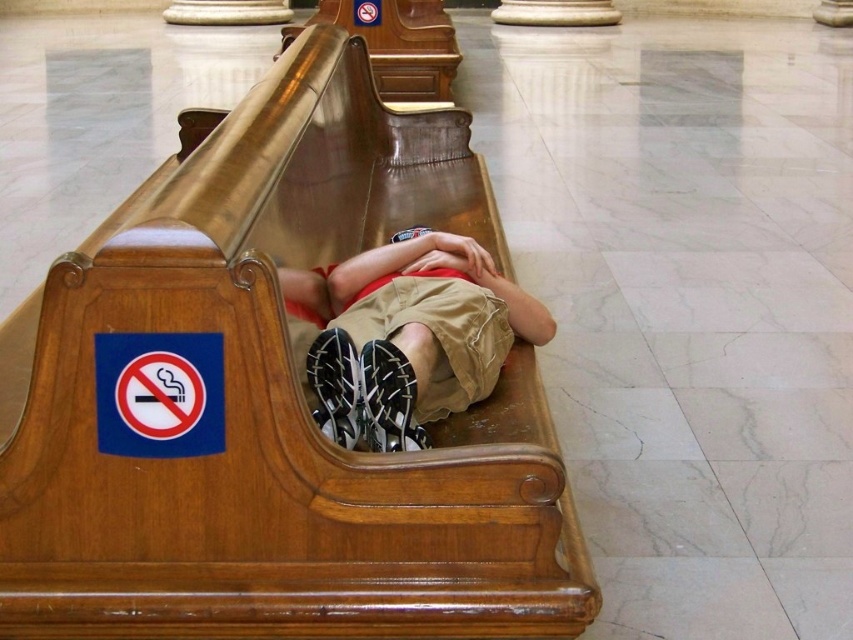
Question: Which point is farther to the camera?

Choices:
 (A) khaki cotton shorts at center
 (B) polished wood church bench at center

Answer: (A)

Question: Is polished wood church bench at center wider than khaki cotton shorts at center?

Choices:
 (A) no
 (B) yes

Answer: (B)

Question: Does polished wood church bench at center have a greater width compared to khaki cotton shorts at center?

Choices:
 (A) yes
 (B) no

Answer: (A)

Question: Which point appears closest to the camera in this image?

Choices:
 (A) (230, 570)
 (B) (370, 429)

Answer: (A)

Question: Is polished wood church bench at center bigger than khaki cotton shorts at center?

Choices:
 (A) yes
 (B) no

Answer: (A)